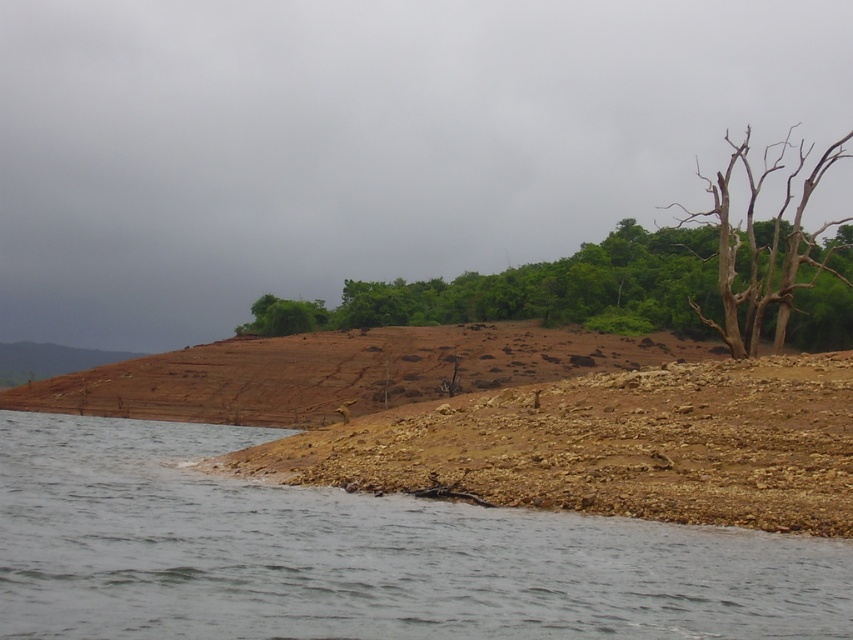
Question: Which of the following is the closest to the observer?

Choices:
 (A) (486, 563)
 (B) (427, 301)

Answer: (A)

Question: Is brown rough tree at center closer to the viewer compared to bare wood tree at upper right?

Choices:
 (A) no
 (B) yes

Answer: (A)

Question: Which point is closer to the camera?

Choices:
 (A) (177, 528)
 (B) (804, 276)

Answer: (A)

Question: Is brown rough tree at center thinner than bare wood tree at upper right?

Choices:
 (A) yes
 (B) no

Answer: (B)

Question: Is gray water at lower left above bare wood tree at upper right?

Choices:
 (A) yes
 (B) no

Answer: (B)

Question: Estimate the real-world distances between objects in this image. Which object is closer to the bare wood tree at upper right?

Choices:
 (A) brown rough tree at center
 (B) gray water at lower left

Answer: (A)